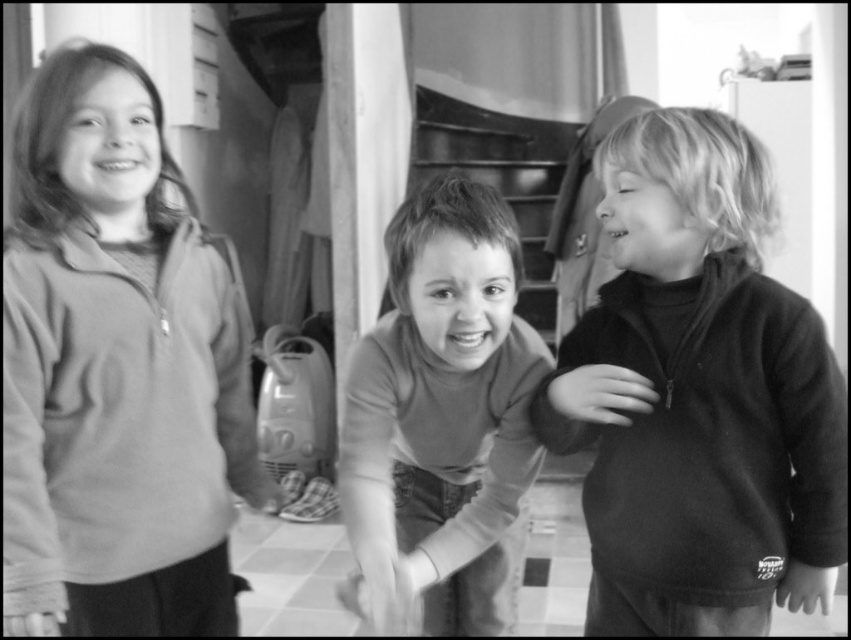
Question: In this image, where is soft fleece sweatshirt at left located relative to smooth brown shirt at center?

Choices:
 (A) left
 (B) right

Answer: (A)

Question: Which point is farther to the camera?

Choices:
 (A) soft fleece sweatshirt at left
 (B) smooth brown shirt at center
 (C) velvet black sweater at right

Answer: (A)

Question: Does soft fleece sweatshirt at left appear under smooth brown shirt at center?

Choices:
 (A) no
 (B) yes

Answer: (A)

Question: Which object is the farthest from the velvet black sweater at right?

Choices:
 (A) smooth brown shirt at center
 (B) soft fleece sweatshirt at left

Answer: (B)

Question: Which point appears farthest from the camera in this image?

Choices:
 (A) (790, 470)
 (B) (56, 396)

Answer: (A)

Question: Does soft fleece sweatshirt at left have a larger size compared to velvet black sweater at right?

Choices:
 (A) yes
 (B) no

Answer: (A)